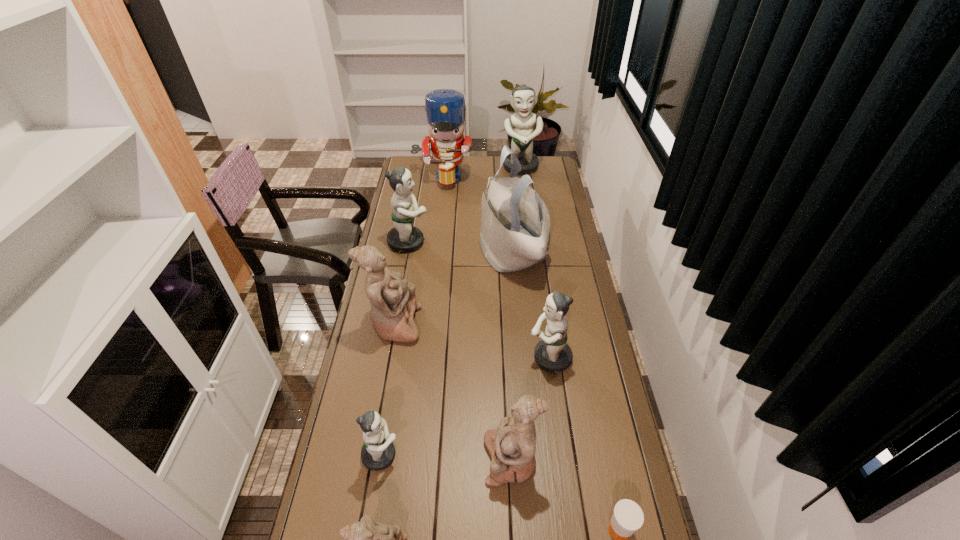
The image size is (960, 540). In order to click on vacant space situated 0.070m on the front-facing side of the second nearest white figurine in this screenshot , I will do `click(460, 459)`.

Where is `free location located on the front-facing side of the second nearest white figurine`? free location located on the front-facing side of the second nearest white figurine is located at coordinates (390, 459).

This screenshot has height=540, width=960. Identify the location of free region located on the front-facing side of the smallest green figurine. (484, 455).

The width and height of the screenshot is (960, 540). In order to click on figurine positioned at the far edge in this screenshot , I will do `click(521, 126)`.

Where is `nutcracker present at the far edge`? The image size is (960, 540). nutcracker present at the far edge is located at coordinates (445, 108).

Where is `nutcracker that is at the left edge`? The height and width of the screenshot is (540, 960). nutcracker that is at the left edge is located at coordinates (445, 108).

Where is `shopping bag positioned at the right edge`? The width and height of the screenshot is (960, 540). shopping bag positioned at the right edge is located at coordinates (515, 231).

The image size is (960, 540). I want to click on object located in the far left corner section of the desktop, so click(x=445, y=108).

Locate an element on the screen. This screenshot has width=960, height=540. object at the far right corner is located at coordinates (521, 126).

In the image, there is a desktop. Where is `vacant space at the left edge`? This screenshot has width=960, height=540. vacant space at the left edge is located at coordinates (401, 257).